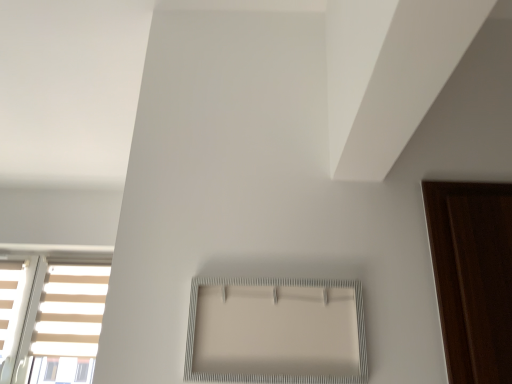
How much space does white textured frame at center, which is counted as the second window, starting from the bottom, occupy vertically?

white textured frame at center, which is counted as the second window, starting from the bottom, is 9.64 inches in height.

What do you see at coordinates (51, 315) in the screenshot? I see `white striped window at lower left, placed as the 1th window when sorted from bottom to top` at bounding box center [51, 315].

Image resolution: width=512 pixels, height=384 pixels. What are the coordinates of `white textured frame at center, which ranks as the 2th window in left-to-right order` in the screenshot? It's located at click(276, 331).

How distant is white striped window at lower left, the second window when ordered from top to bottom, from white textured frame at center, which ranks as the 2th window in left-to-right order?

white striped window at lower left, the second window when ordered from top to bottom, is 2.09 meters from white textured frame at center, which ranks as the 2th window in left-to-right order.

Based on their sizes in the image, would you say white striped window at lower left, the 2th window viewed from the front, is bigger or smaller than white textured frame at center, the 2th window from the back?

white striped window at lower left, the 2th window viewed from the front, is bigger than white textured frame at center, the 2th window from the back.

Find the location of a particular element. Image resolution: width=512 pixels, height=384 pixels. window behind the white textured frame at center, which is the 1th window from top to bottom is located at coordinates (51, 315).

From a real-world perspective, which object stands above the other?

In real-world perspective, white striped window at lower left, the first window positioned from the back, is above.

Measure the distance between white matte blind at upper right and white textured frame at center, which ranks as the first window in right-to-left order.

white matte blind at upper right and white textured frame at center, which ranks as the first window in right-to-left order, are 19.12 inches apart.

Considering the relative sizes of white matte blind at upper right and white textured frame at center, which ranks as the 2th window in left-to-right order, in the image provided, is white matte blind at upper right taller than white textured frame at center, which ranks as the 2th window in left-to-right order,?

In fact, white matte blind at upper right may be shorter than white textured frame at center, which ranks as the 2th window in left-to-right order.

Does white matte blind at upper right have a larger size compared to white textured frame at center, which ranks as the 2th window in left-to-right order?

Actually, white matte blind at upper right might be smaller than white textured frame at center, which ranks as the 2th window in left-to-right order.

Which object is thinner, white matte blind at upper right or white textured frame at center, the 2th window from the back?

With smaller width is white textured frame at center, the 2th window from the back.

Does white textured frame at center, which ranks as the 2th window in left-to-right order, come in front of white matte blind at upper right?

No, it is not.

Does point (330, 381) appear closer or farther from the camera than point (399, 54)?

Point (330, 381) is farther from the camera than point (399, 54).

Considering the relative positions of white textured frame at center, which ranks as the first window in right-to-left order, and white matte blind at upper right in the image provided, is white textured frame at center, which ranks as the first window in right-to-left order, to the right of white matte blind at upper right from the viewer's perspective?

No.

From a real-world perspective, which object rests below the other?

white textured frame at center, which is the 1th window from top to bottom, is physically lower.

Looking at this image, from a real-world perspective, which is physically above, white striped window at lower left, the first window positioned from the back, or white matte blind at upper right?

white matte blind at upper right is physically above.

Is white striped window at lower left, the first window positioned from the back, positioned beyond the bounds of white matte blind at upper right?

Yes, white striped window at lower left, the first window positioned from the back, is located beyond the bounds of white matte blind at upper right.

From the image's perspective, is white striped window at lower left, positioned as the 1th window in left-to-right order, located above or below white matte blind at upper right?

Based on their image positions, white striped window at lower left, positioned as the 1th window in left-to-right order, is located beneath white matte blind at upper right.

In the scene shown: Can you confirm if white textured frame at center, which is counted as the second window, starting from the bottom, is taller than white striped window at lower left, which is the 2th window from right to left?

No.

Is white textured frame at center, which is counted as the second window, starting from the bottom, oriented away from white striped window at lower left, positioned as the 1th window in left-to-right order?

No, white striped window at lower left, positioned as the 1th window in left-to-right order, is not at the back of white textured frame at center, which is counted as the second window, starting from the bottom.

Which is more distant, (256, 357) or (105, 271)?

The point (105, 271) is more distant.

Considering the positions of objects white textured frame at center, which is the 1th window from top to bottom, and white striped window at lower left, the 2th window viewed from the front, in the image provided, who is more to the right, white textured frame at center, which is the 1th window from top to bottom, or white striped window at lower left, the 2th window viewed from the front,?

Positioned to the right is white textured frame at center, which is the 1th window from top to bottom.

From the image's perspective, does white matte blind at upper right appear higher than white striped window at lower left, the 2th window viewed from the front?

Correct, white matte blind at upper right appears higher than white striped window at lower left, the 2th window viewed from the front, in the image.

Is white matte blind at upper right far away from white striped window at lower left, placed as the 1th window when sorted from bottom to top?

Yes, white matte blind at upper right and white striped window at lower left, placed as the 1th window when sorted from bottom to top, are quite far apart.

Considering the relative positions of white matte blind at upper right and white striped window at lower left, the first window positioned from the back, in the image provided, is white matte blind at upper right to the right of white striped window at lower left, the first window positioned from the back, from the viewer's perspective?

Indeed, white matte blind at upper right is positioned on the right side of white striped window at lower left, the first window positioned from the back.

Is white striped window at lower left, the first window positioned from the back, surrounded by white matte blind at upper right?

No, white striped window at lower left, the first window positioned from the back, is not inside white matte blind at upper right.

Find the location of a particular element. window that is under the white striped window at lower left, placed as the 1th window when sorted from bottom to top (from a real-world perspective) is located at coordinates (276, 331).

From the image's perspective, count 1st windows downward from the white matte blind at upper right and point to it. Please provide its 2D coordinates.

[(276, 331)]

Estimate the real-world distances between objects in this image. Which object is closer to white striped window at lower left, positioned as the 1th window in left-to-right order, white textured frame at center, the 2th window from the back, or white matte blind at upper right?

white textured frame at center, the 2th window from the back, is positioned closer to the anchor white striped window at lower left, positioned as the 1th window in left-to-right order.

Based on their spatial positions, is white striped window at lower left, the 2th window viewed from the front, or white textured frame at center, which is counted as the second window, starting from the bottom, closer to white matte blind at upper right?

white textured frame at center, which is counted as the second window, starting from the bottom, is positioned closer to the anchor white matte blind at upper right.

When comparing their distances from white matte blind at upper right, does white textured frame at center, which ranks as the 2th window in left-to-right order, or white striped window at lower left, the second window when ordered from top to bottom, seem closer?

The object closer to white matte blind at upper right is white textured frame at center, which ranks as the 2th window in left-to-right order.

Which object lies further to the anchor point white textured frame at center, which is counted as the second window, starting from the bottom, white striped window at lower left, the first window positioned from the back, or white matte blind at upper right?

white striped window at lower left, the first window positioned from the back.

In the scene shown: When comparing their distances from white striped window at lower left, placed as the 1th window when sorted from bottom to top, does white matte blind at upper right or white textured frame at center, the 2th window from the back, seem closer?

Among the two, white textured frame at center, the 2th window from the back, is located nearer to white striped window at lower left, placed as the 1th window when sorted from bottom to top.

Estimate the real-world distances between objects in this image. Which object is closer to white textured frame at center, which ranks as the 2th window in left-to-right order, white matte blind at upper right or white striped window at lower left, the second window when ordered from top to bottom?

white matte blind at upper right is positioned closer to the anchor white textured frame at center, which ranks as the 2th window in left-to-right order.

The width and height of the screenshot is (512, 384). I want to click on window located between white matte blind at upper right and white striped window at lower left, the second window when ordered from top to bottom, in the depth direction, so click(276, 331).